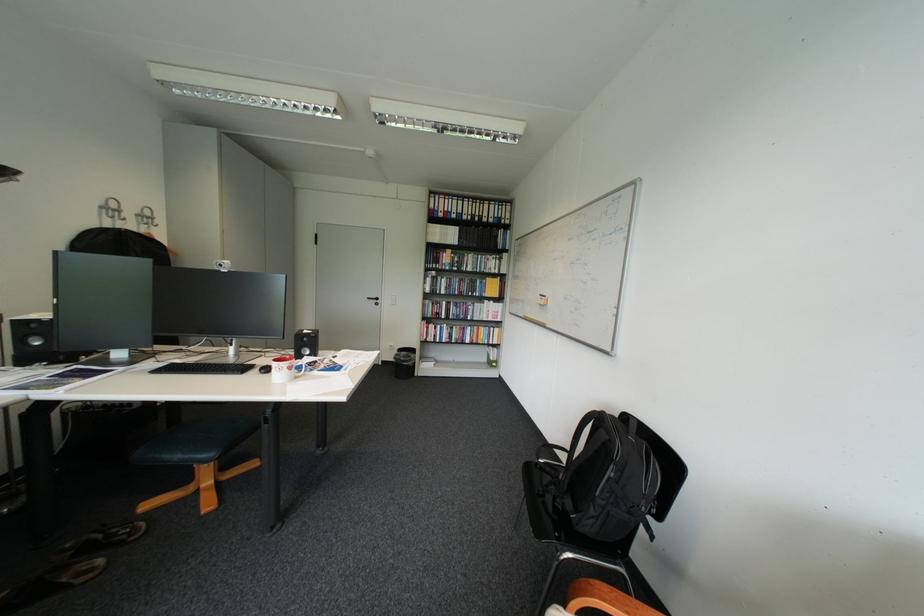
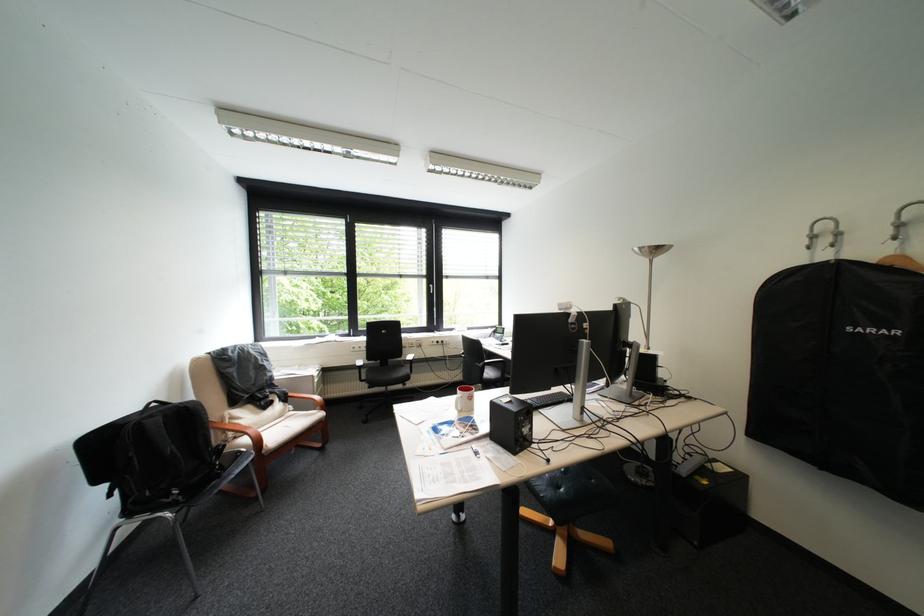
Question: I am providing you with two images of the same scene from different viewpoints. Please identify which objects are invisible in image2.

Choices:
 (A) ottoman sitting surface
 (B) red and white mug
 (C) black speaker
 (D) black garment bag

Answer: (C)